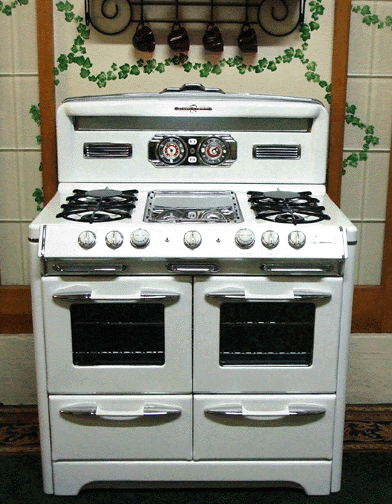
Image resolution: width=392 pixels, height=504 pixels. What are the coordinates of `front right burner` in the screenshot? It's located at (297, 215).